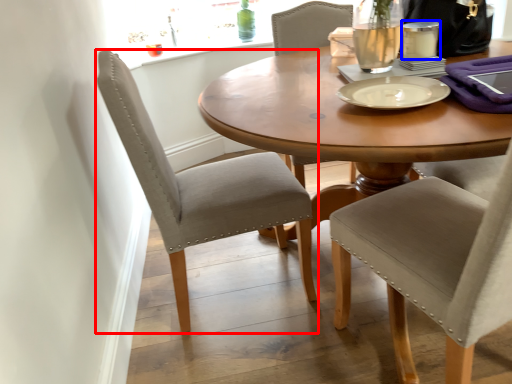
Question: Which object appears farthest to the camera in this image, chair (highlighted by a red box) or tableware (highlighted by a blue box)?

Choices:
 (A) chair
 (B) tableware

Answer: (B)